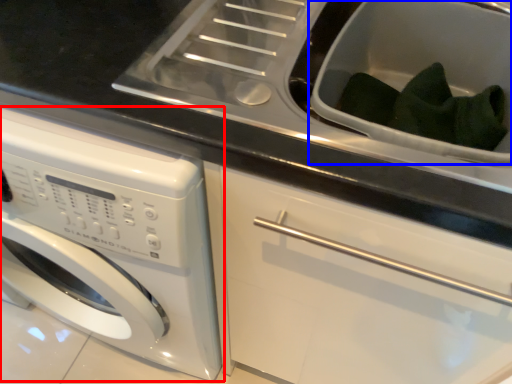
Question: Which of the following is the farthest to the observer, washing machine (highlighted by a red box) or sink (highlighted by a blue box)?

Choices:
 (A) washing machine
 (B) sink

Answer: (B)